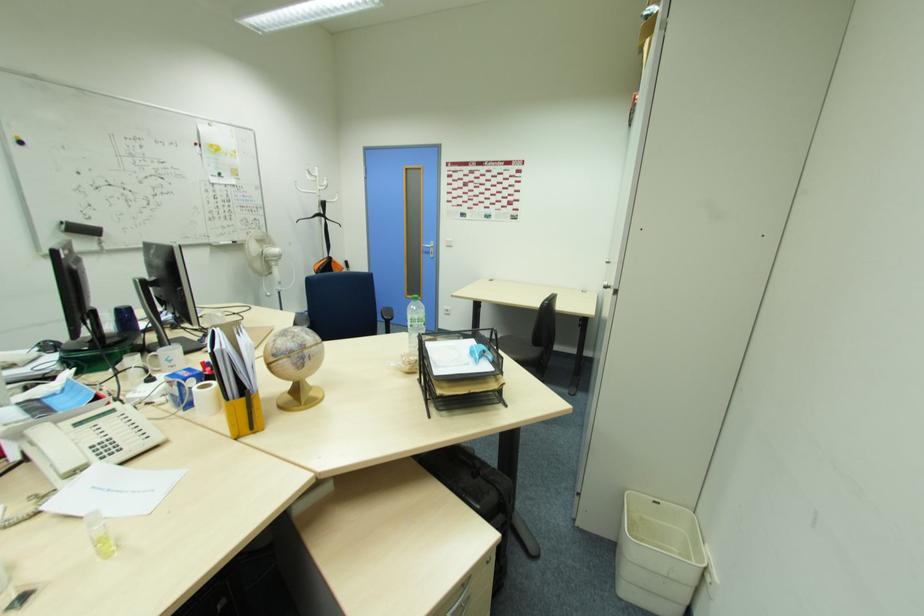
The location [126,320] corresponds to which object?

It refers to a blue cup.